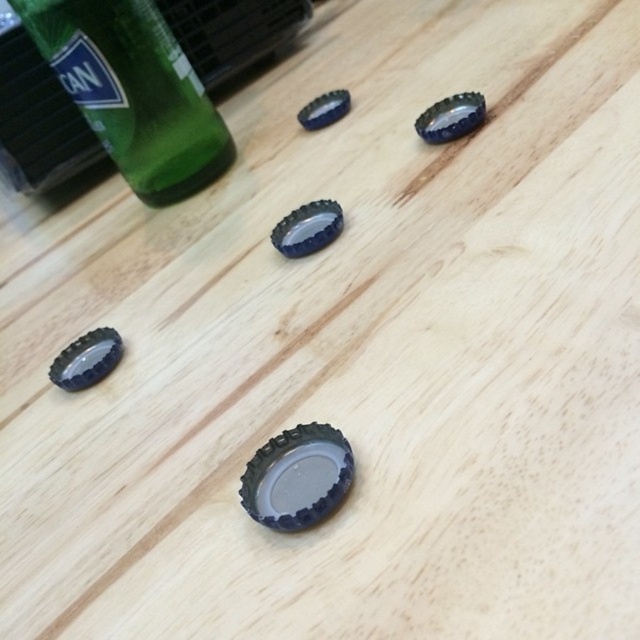
You are holding a magnifying glass and looking at the wooden surface. The black rubber bottle cap at lower left is partially covered by a leaf. Can you see the entire cap?

The black rubber bottle cap at lower left is 37.41 inches away from viewer, so no, the leaf is covering part of it and you cannot see the entire cap.

You are trying to stack the black rubber bottle cap at lower left and the black rubber bottle cap at upper center. Which one should you place at the bottom to ensure stability?

The black rubber bottle cap at lower left should be placed at the bottom since it might be wider than the black rubber bottle cap at upper center, providing a more stable base.